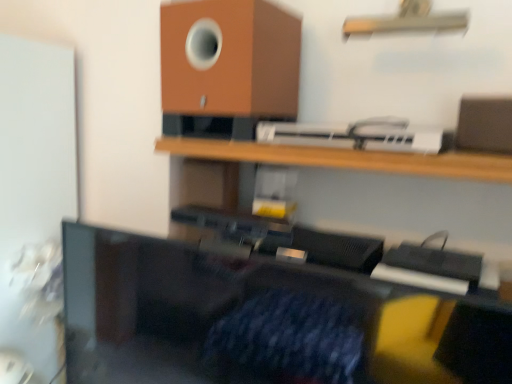
Find the location of a particular element. The image size is (512, 384). brown matte speaker at upper center is located at coordinates (230, 59).

What is the approximate width of brown matte speaker at upper center?

brown matte speaker at upper center is 11.61 inches in width.

Describe the element at coordinates (262, 320) in the screenshot. I see `black plastic monitor at center` at that location.

Identify the location of white plastic printer at upper center. The width and height of the screenshot is (512, 384). (356, 136).

Where is `wooden shelf at upper center, the second shelf positioned from the top`? The width and height of the screenshot is (512, 384). wooden shelf at upper center, the second shelf positioned from the top is located at coordinates (345, 158).

Where is `speaker on the left of the white plastic printer at upper center`? Image resolution: width=512 pixels, height=384 pixels. speaker on the left of the white plastic printer at upper center is located at coordinates (230, 59).

From a real-world perspective, is white plastic printer at upper center positioned over brown matte speaker at upper center based on gravity?

Actually, white plastic printer at upper center is physically below brown matte speaker at upper center in the real world.

Does point (429, 148) come farther from viewer compared to point (167, 44)?

No, (429, 148) is in front of (167, 44).

From the picture: Between white plastic printer at upper center and black plastic monitor at center, which one has larger width?

With larger width is white plastic printer at upper center.

Considering their positions, is white plastic printer at upper center located in front of or behind black plastic monitor at center?

white plastic printer at upper center is positioned farther from the viewer than black plastic monitor at center.

Is white plastic printer at upper center not within black plastic monitor at center?

Absolutely, white plastic printer at upper center is external to black plastic monitor at center.

Which of these two, metallic silver shelf at upper center, positioned as the 1th shelf in top-to-bottom order, or black plastic monitor at center, is bigger?

With larger size is black plastic monitor at center.

Is the surface of metallic silver shelf at upper center, positioned as the 1th shelf in top-to-bottom order, in direct contact with black plastic monitor at center?

metallic silver shelf at upper center, positioned as the 1th shelf in top-to-bottom order, and black plastic monitor at center are not in contact.

From a real-world perspective, is metallic silver shelf at upper center, marked as the 2th shelf in a bottom-to-top arrangement, physically above black plastic monitor at center?

Yes, from a real-world perspective, metallic silver shelf at upper center, marked as the 2th shelf in a bottom-to-top arrangement, is over black plastic monitor at center

Which is closer to the camera, (345, 23) or (102, 271)?

Point (345, 23).

From a real-world perspective, who is located higher, wooden shelf at upper center, the first shelf ordered from the bottom, or white plastic printer at upper center?

In real-world perspective, white plastic printer at upper center is above.

Is white plastic printer at upper center a part of wooden shelf at upper center, the first shelf ordered from the bottom?

No, white plastic printer at upper center is not a part of wooden shelf at upper center, the first shelf ordered from the bottom.

Considering the sizes of wooden shelf at upper center, the second shelf positioned from the top, and white plastic printer at upper center in the image, is wooden shelf at upper center, the second shelf positioned from the top, bigger or smaller than white plastic printer at upper center?

Clearly, wooden shelf at upper center, the second shelf positioned from the top, is larger in size than white plastic printer at upper center.

Considering the relative sizes of wooden shelf at upper center, the first shelf ordered from the bottom, and white plastic printer at upper center in the image provided, is wooden shelf at upper center, the first shelf ordered from the bottom, thinner than white plastic printer at upper center?

No, wooden shelf at upper center, the first shelf ordered from the bottom, is not thinner than white plastic printer at upper center.

Can you tell me how much metallic silver shelf at upper center, positioned as the 1th shelf in top-to-bottom order, and white plastic printer at upper center differ in facing direction?

The angle between the facing direction of metallic silver shelf at upper center, positioned as the 1th shelf in top-to-bottom order, and the facing direction of white plastic printer at upper center is 2.33 degrees.

This screenshot has width=512, height=384. I want to click on printer in front of the metallic silver shelf at upper center, marked as the 2th shelf in a bottom-to-top arrangement, so click(x=356, y=136).

Between point (388, 18) and point (338, 138), which one is positioned in front?

The point (338, 138) is closer.

The width and height of the screenshot is (512, 384). I want to click on the 2nd shelf to the right when counting from the brown matte speaker at upper center, so click(x=407, y=21).

Is metallic silver shelf at upper center, positioned as the 1th shelf in top-to-bottom order, looking in the opposite direction of brown matte speaker at upper center?

No, metallic silver shelf at upper center, positioned as the 1th shelf in top-to-bottom order, is not facing the opposite direction of brown matte speaker at upper center.

Between metallic silver shelf at upper center, marked as the 2th shelf in a bottom-to-top arrangement, and brown matte speaker at upper center, which one has smaller width?

metallic silver shelf at upper center, marked as the 2th shelf in a bottom-to-top arrangement.

Can you confirm if wooden shelf at upper center, the first shelf ordered from the bottom, is bigger than brown matte speaker at upper center?

No.

Choose the correct answer: Is wooden shelf at upper center, the first shelf ordered from the bottom, inside brown matte speaker at upper center or outside it?

The correct answer is: outside.

Where is `speaker located on the left of white plastic printer at upper center`? speaker located on the left of white plastic printer at upper center is located at coordinates (230, 59).

You are a GUI agent. You are given a task and a screenshot of the screen. Output one action in this format:
    pyautogui.click(x=<x>, y=<y>)
    Task: Click on the furniture in front of the white plastic printer at upper center
    The width and height of the screenshot is (512, 384).
    Given the screenshot: What is the action you would take?
    pyautogui.click(x=262, y=320)

Based on their spatial positions, is brown matte speaker at upper center or white plastic printer at upper center closer to wooden shelf at upper center, the second shelf positioned from the top?

Among the two, white plastic printer at upper center is located nearer to wooden shelf at upper center, the second shelf positioned from the top.

In the scene shown: Which object lies nearer to the anchor point white plastic printer at upper center, metallic silver shelf at upper center, positioned as the 1th shelf in top-to-bottom order, or brown matte speaker at upper center?

brown matte speaker at upper center.

When comparing their distances from metallic silver shelf at upper center, positioned as the 1th shelf in top-to-bottom order, does brown matte speaker at upper center or black plastic monitor at center seem further?

Among the two, black plastic monitor at center is located further to metallic silver shelf at upper center, positioned as the 1th shelf in top-to-bottom order.

Based on their spatial positions, is metallic silver shelf at upper center, positioned as the 1th shelf in top-to-bottom order, or white plastic printer at upper center further from black plastic monitor at center?

Based on the image, metallic silver shelf at upper center, positioned as the 1th shelf in top-to-bottom order, appears to be further to black plastic monitor at center.

Estimate the real-world distances between objects in this image. Which object is further from white plastic printer at upper center, metallic silver shelf at upper center, positioned as the 1th shelf in top-to-bottom order, or black plastic monitor at center?

The object further to white plastic printer at upper center is black plastic monitor at center.

Which object lies nearer to the anchor point wooden shelf at upper center, the first shelf ordered from the bottom, brown matte speaker at upper center or metallic silver shelf at upper center, marked as the 2th shelf in a bottom-to-top arrangement?

brown matte speaker at upper center is positioned closer to the anchor wooden shelf at upper center, the first shelf ordered from the bottom.

Based on their spatial positions, is white plastic printer at upper center or wooden shelf at upper center, the second shelf positioned from the top, further from brown matte speaker at upper center?

wooden shelf at upper center, the second shelf positioned from the top, is further to brown matte speaker at upper center.

Estimate the real-world distances between objects in this image. Which object is closer to metallic silver shelf at upper center, marked as the 2th shelf in a bottom-to-top arrangement, wooden shelf at upper center, the second shelf positioned from the top, or brown matte speaker at upper center?

The object closer to metallic silver shelf at upper center, marked as the 2th shelf in a bottom-to-top arrangement, is brown matte speaker at upper center.

This screenshot has width=512, height=384. I want to click on shelf situated between brown matte speaker at upper center and white plastic printer at upper center from left to right, so click(x=345, y=158).

Find the location of a particular element. The width and height of the screenshot is (512, 384). shelf between brown matte speaker at upper center and black plastic monitor at center from top to bottom is located at coordinates (345, 158).

You are a GUI agent. You are given a task and a screenshot of the screen. Output one action in this format:
    pyautogui.click(x=<x>, y=<y>)
    Task: Click on the printer between brown matte speaker at upper center and black plastic monitor at center in the up-down direction
    The width and height of the screenshot is (512, 384).
    Given the screenshot: What is the action you would take?
    pyautogui.click(x=356, y=136)

The image size is (512, 384). In order to click on printer between metallic silver shelf at upper center, positioned as the 1th shelf in top-to-bottom order, and black plastic monitor at center, in the vertical direction in this screenshot , I will do `click(356, 136)`.